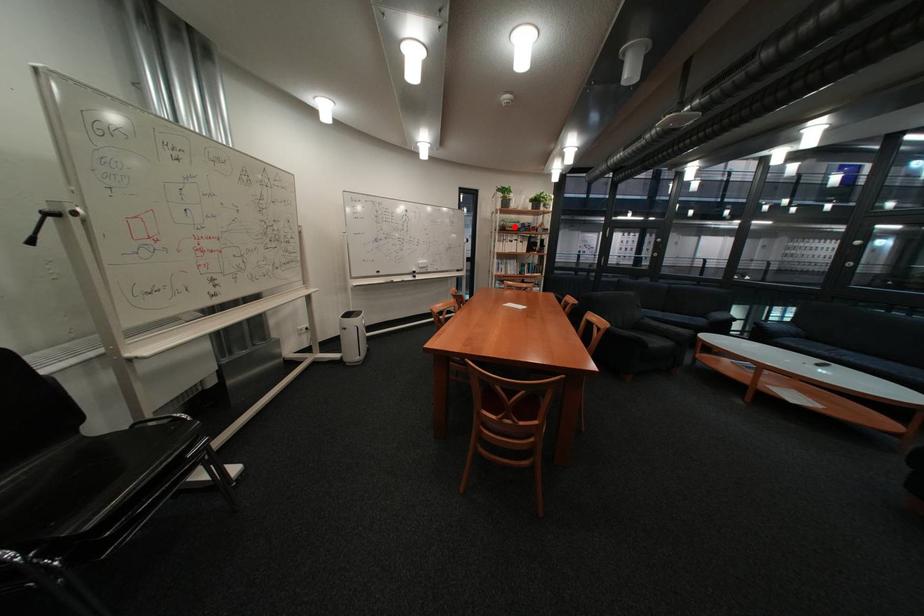
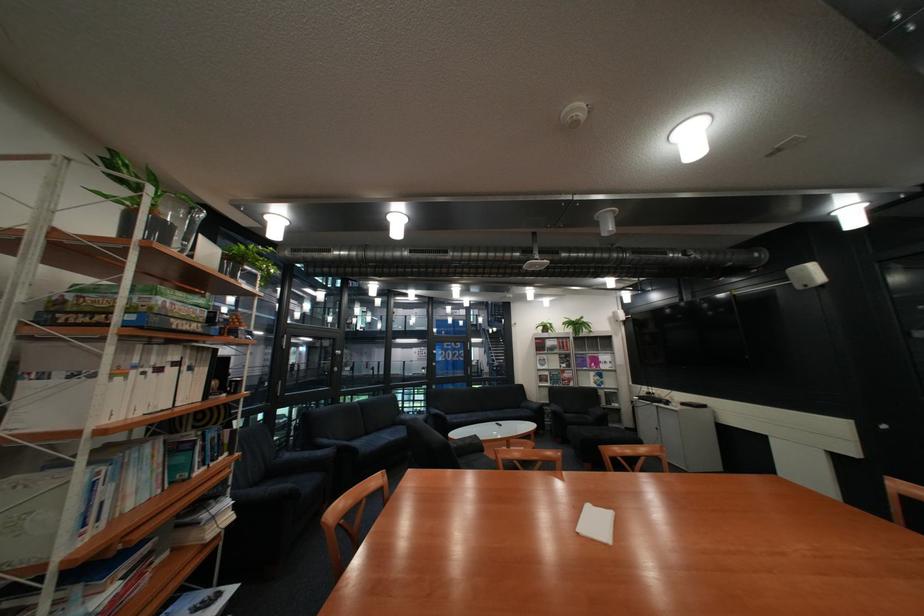
Question: I am providing you with two images of the same scene from different viewpoints. Given a red point in image1, look at the same physical point in image2. Is it:

Choices:
 (A) Closer to the viewpoint
 (B) Farther from the viewpoint

Answer: (B)